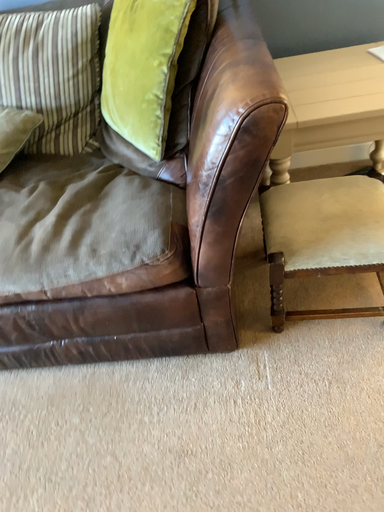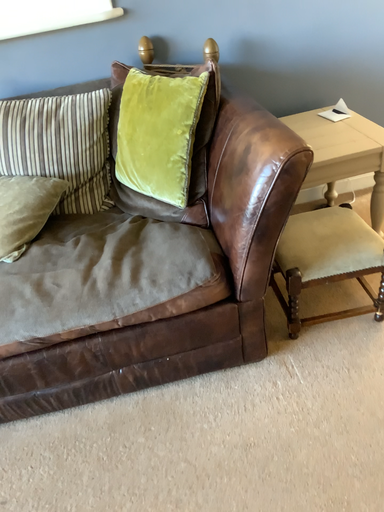
Question: How did the camera likely rotate when shooting the video?

Choices:
 (A) rotated downward
 (B) rotated upward

Answer: (B)